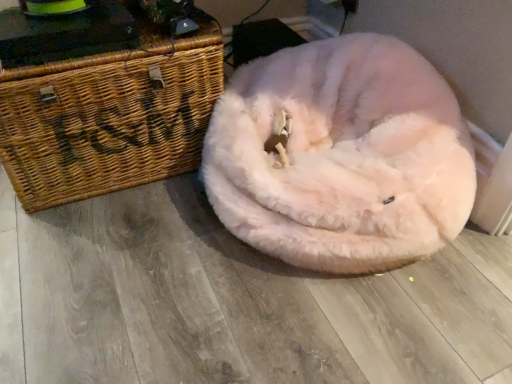
Where is `free space to the left of fluffy pink dog bed at center`? free space to the left of fluffy pink dog bed at center is located at coordinates (119, 258).